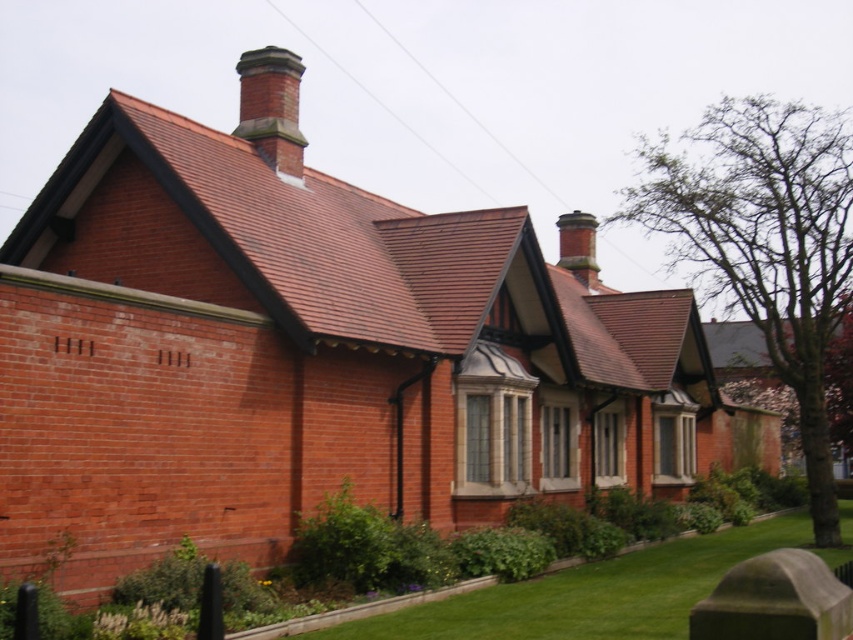
You are standing 30 meters away from a brick chimney at upper center located on a traditional brick building. Can you safely walk towards it without needing to adjust your path?

The brick chimney at upper center is 29.41 meters away, which is just under 30 meters. Since you are already 30 meters away, you are very close to the correct distance. However, you might need to slightly adjust your path to ensure you are precisely at 29.41 meters away from the brick chimney at upper center.

You are a gardener looking at the green grass at lower center and the brick chimney at upper center in the image. Which object appears narrower when viewed from your current position?

The green grass at lower center appears narrower than the brick chimney at upper center because it is thinner.